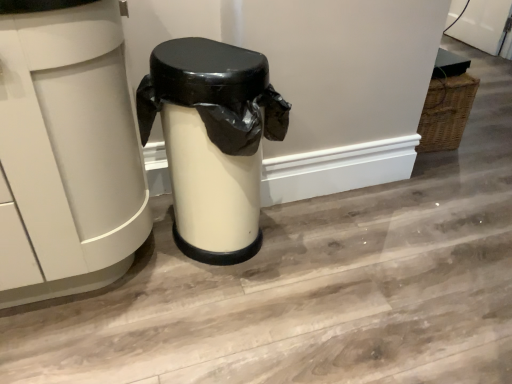
Question: Considering the positions of white matte trash can at center, which appears as the first waste container when viewed from the left, and matte white trash can at center, the 2th waste container when ordered from left to right, in the image, is white matte trash can at center, which appears as the first waste container when viewed from the left, taller or shorter than matte white trash can at center, the 2th waste container when ordered from left to right,?

Choices:
 (A) tall
 (B) short

Answer: (A)

Question: Considering the positions of point (101, 241) and point (181, 137), is point (101, 241) closer or farther from the camera than point (181, 137)?

Choices:
 (A) closer
 (B) farther

Answer: (A)

Question: Looking at their shapes, would you say white matte trash can at center, acting as the 2th waste container starting from the right, is wider or thinner than matte white trash can at center, the 2th waste container when ordered from left to right?

Choices:
 (A) wide
 (B) thin

Answer: (A)

Question: Is matte white trash can at center, the 1th waste container from the right, bigger or smaller than white matte trash can at center, which appears as the first waste container when viewed from the left?

Choices:
 (A) small
 (B) big

Answer: (A)

Question: Considering their positions, is matte white trash can at center, the 1th waste container from the right, located in front of or behind white matte trash can at center, acting as the 2th waste container starting from the right?

Choices:
 (A) front
 (B) behind

Answer: (B)

Question: Is matte white trash can at center, the 2th waste container when ordered from left to right, wider or thinner than white matte trash can at center, acting as the 2th waste container starting from the right?

Choices:
 (A) thin
 (B) wide

Answer: (A)

Question: From a real-world perspective, is matte white trash can at center, the 2th waste container when ordered from left to right, positioned above or below white matte trash can at center, which appears as the first waste container when viewed from the left?

Choices:
 (A) above
 (B) below

Answer: (B)